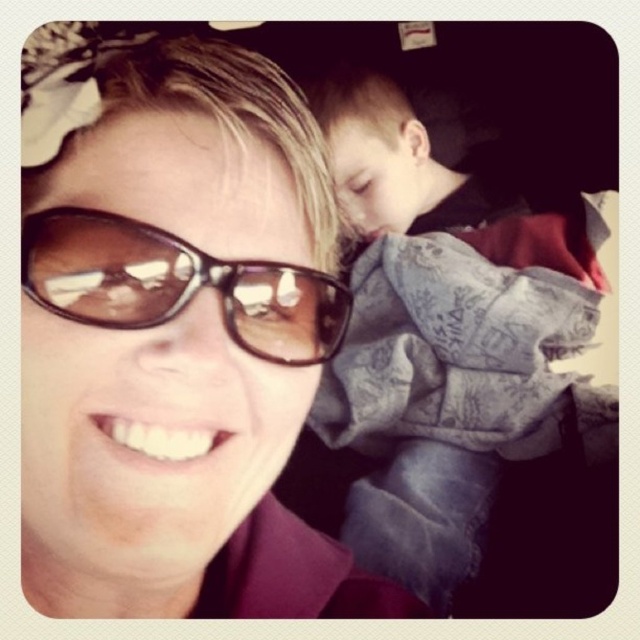
You are taking a selfie and notice two pairs of sunglasses in the frame. One is the matte brown sunglasses at upper left and the other is the sunglasses at center. Which pair is positioned lower in the photo?

The matte brown sunglasses at upper left is located below the sunglasses at center, so the matte brown sunglasses at upper left is positioned lower in the photo.

You are taking a photo and notice the denim jacket at upper right and the sunglasses at center. Which object is closer to the camera?

The denim jacket at upper right is closer to the camera because the sunglasses at center is behind it.

You are taking a photo and want to ensure the denim jacket at upper right and the sunglasses at center are both visible. Which object should you adjust your focus on to keep both in frame?

The denim jacket at upper right is positioned on the right side of sunglasses at center. To keep both in frame, adjust focus on the sunglasses at center since it is centrally located, ensuring the denim jacket at upper right remains within the right side of the frame.